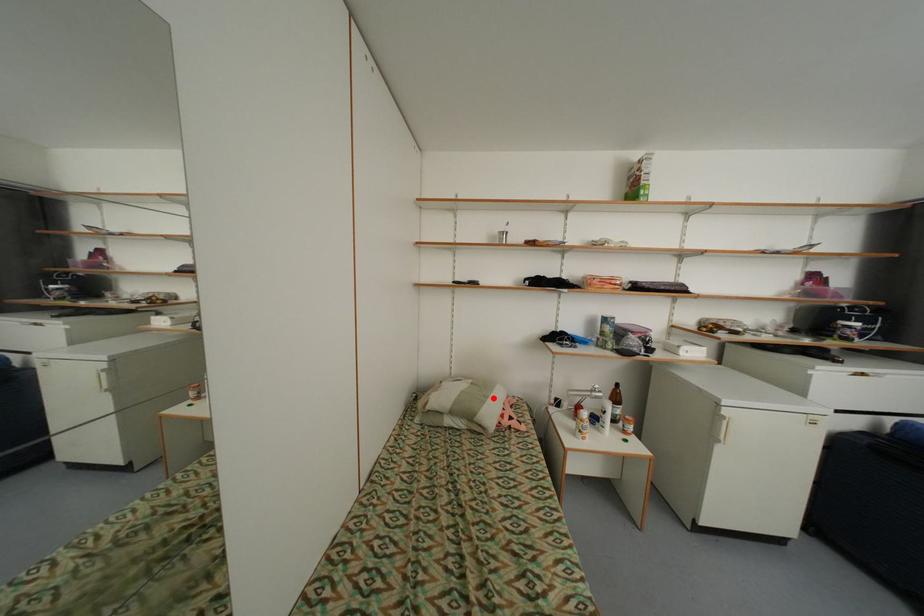
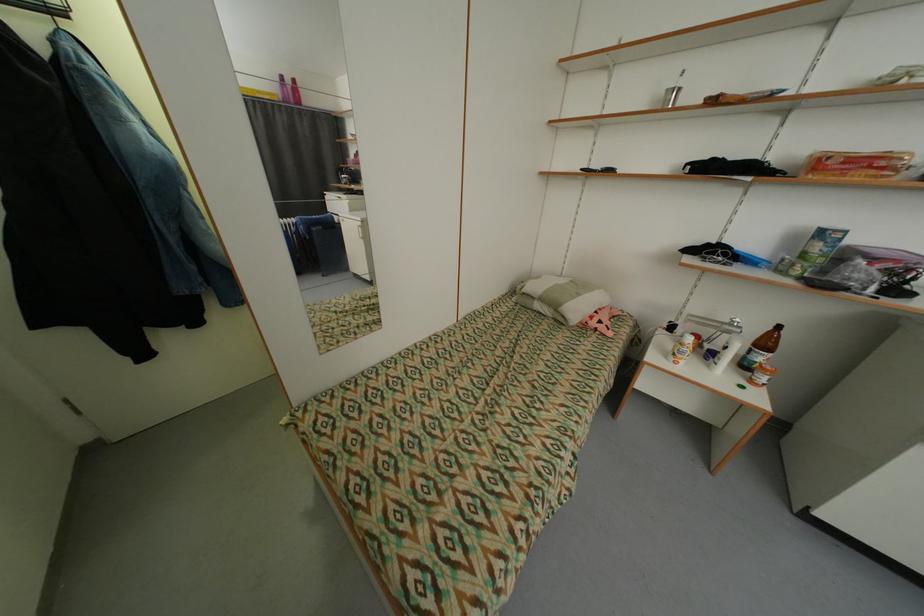
Question: A red point is marked in image1. In image2, is the corresponding 3D point closer to the camera or farther? Reply with the corresponding letter.

Choices:
 (A) The corresponding 3D point is closer.
 (B) The corresponding 3D point is farther.

Answer: (A)